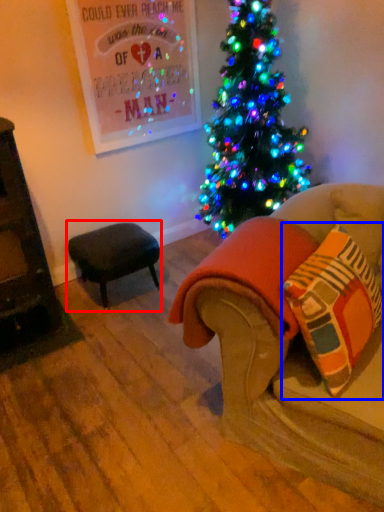
Question: Among these objects, which one is nearest to the camera, table (highlighted by a red box) or throw pillow (highlighted by a blue box)?

Choices:
 (A) table
 (B) throw pillow

Answer: (B)